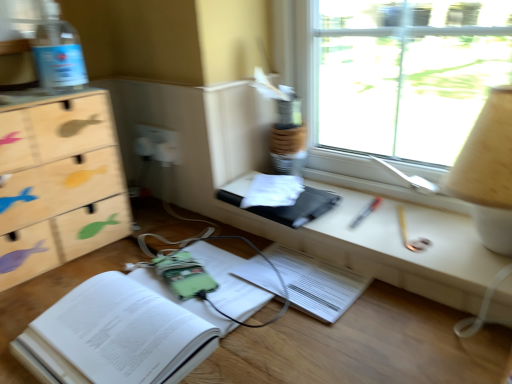
The width and height of the screenshot is (512, 384). Identify the location of unoccupied space behind beige fabric lampshade at upper right. (404, 205).